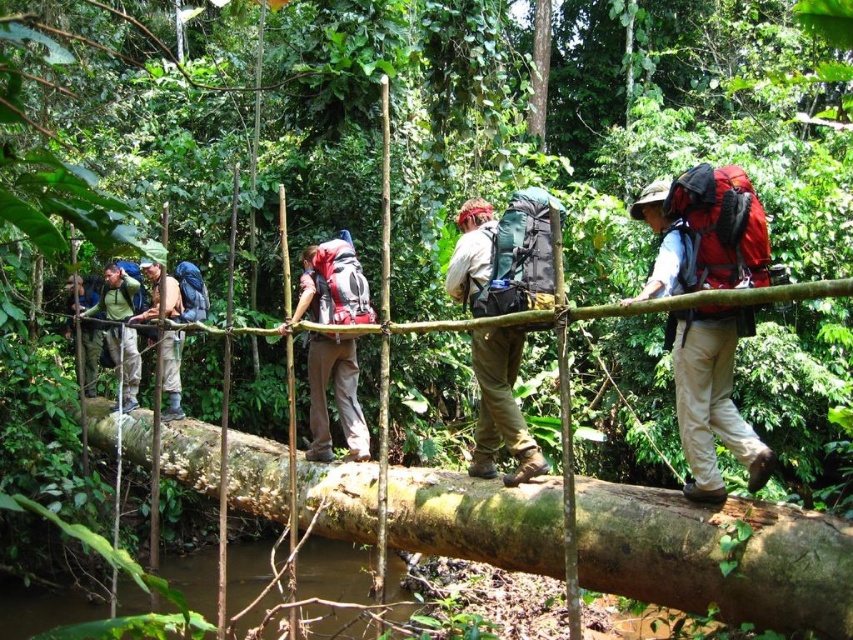
Based on the photo, can you confirm if green rough wood log at center is positioned to the left of matte khaki pants at center?

No, green rough wood log at center is not to the left of matte khaki pants at center.

Which is in front, point (763, 548) or point (154, 298)?

Positioned in front is point (763, 548).

Find the location of a particular element. green rough wood log at center is located at coordinates (717, 557).

The width and height of the screenshot is (853, 640). What are the coordinates of `matte black backpack at center` in the screenshot? It's located at (502, 257).

The width and height of the screenshot is (853, 640). What do you see at coordinates (502, 257) in the screenshot?
I see `matte black backpack at center` at bounding box center [502, 257].

Measure the distance between matte black backpack at center and camera.

matte black backpack at center and camera are 5.08 meters apart from each other.

What are the coordinates of `matte black backpack at center` in the screenshot? It's located at (502, 257).

Is matte red backpack at center to the right of matte green backpack at left from the viewer's perspective?

Yes, matte red backpack at center is to the right of matte green backpack at left.

Does matte red backpack at center appear over matte green backpack at left?

Correct, matte red backpack at center is located above matte green backpack at left.

Measure the distance between point (666, 292) and camera.

Point (666, 292) is 14.51 feet from camera.

At what (x,y) coordinates should I click in order to perform the action: click on matte red backpack at center. Please return your answer as a coordinate pair (x, y). The height and width of the screenshot is (640, 853). Looking at the image, I should click on (711, 397).